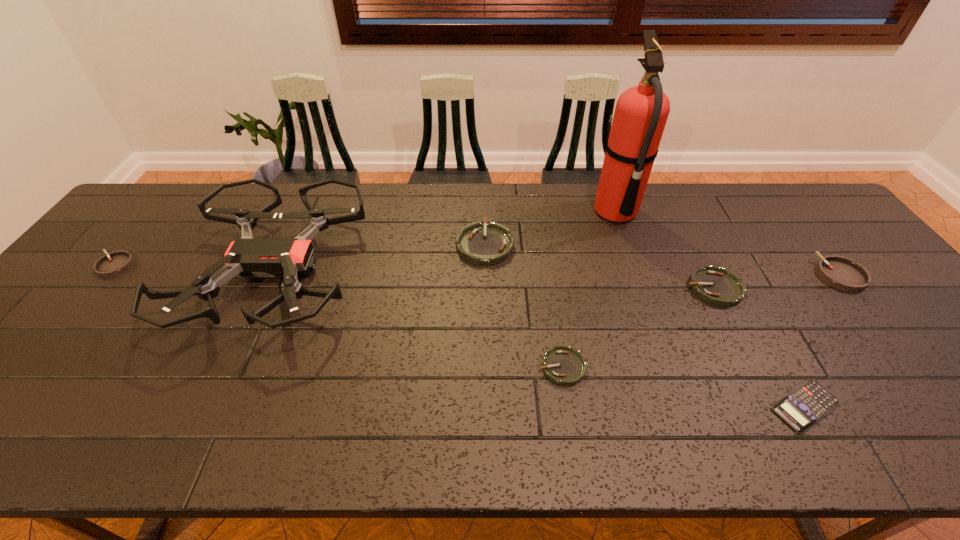
Locate an element on the screen. The height and width of the screenshot is (540, 960). the second farthest green ashtray is located at coordinates (716, 285).

Where is `the second biggest green ashtray`? Image resolution: width=960 pixels, height=540 pixels. the second biggest green ashtray is located at coordinates (716, 285).

The width and height of the screenshot is (960, 540). Identify the location of the smallest green ashtray. (564, 365).

Find the location of a particular element. the shortest ashtray is located at coordinates (564, 365).

Where is `calculator`? calculator is located at coordinates (802, 408).

At what (x,y) coordinates should I click in order to perform the action: click on the shortest object. Please return your answer as a coordinate pair (x, y). Looking at the image, I should click on (802, 408).

The image size is (960, 540). In order to click on free space located at the nozzle of the tallest object in this screenshot , I will do `click(505, 212)`.

Where is `vacant space located at the nozzle of the tallest object`? vacant space located at the nozzle of the tallest object is located at coordinates (480, 212).

Locate an element on the screen. free region located at the nozzle of the tallest object is located at coordinates (565, 212).

Where is `vacant region located 0.140m with the camera facing forward on the second object from left to right`? The image size is (960, 540). vacant region located 0.140m with the camera facing forward on the second object from left to right is located at coordinates (211, 414).